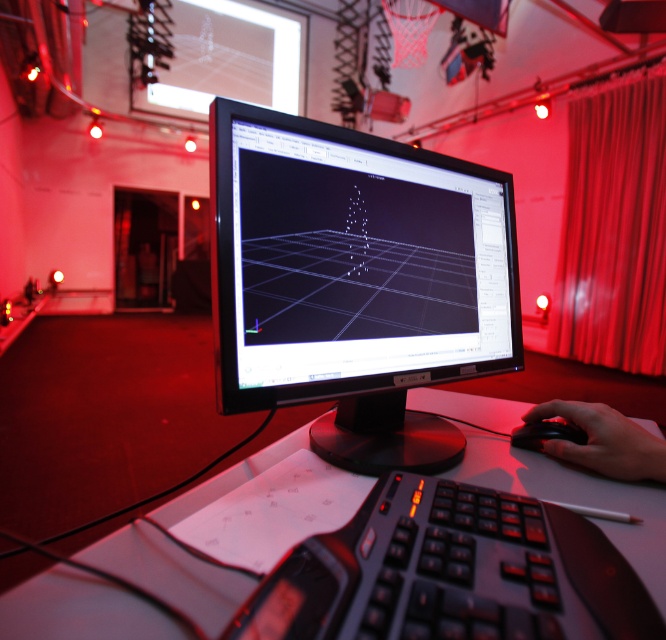
Question: Which of the following is the closest to the observer?

Choices:
 (A) (655, 131)
 (B) (480, 515)
 (C) (573, 404)

Answer: (B)

Question: Does black matte keyboard at center appear under silky white curtain at center?

Choices:
 (A) no
 (B) yes

Answer: (B)

Question: Does black glossy monitor at center have a greater width compared to black matte keyboard at center?

Choices:
 (A) no
 (B) yes

Answer: (B)

Question: Is black matte mouse at lower right further to the viewer compared to black plastic mouse at center?

Choices:
 (A) no
 (B) yes

Answer: (A)

Question: Estimate the real-world distances between objects in this image. Which object is closer to the black matte keyboard at center?

Choices:
 (A) black plastic computer desk at center
 (B) black matte mouse at lower right
 (C) black plastic mouse at center

Answer: (A)

Question: Which object appears farthest from the camera in this image?

Choices:
 (A) black plastic computer desk at center
 (B) black matte mouse at lower right
 (C) black plastic mouse at center
 (D) black glossy monitor at center

Answer: (C)